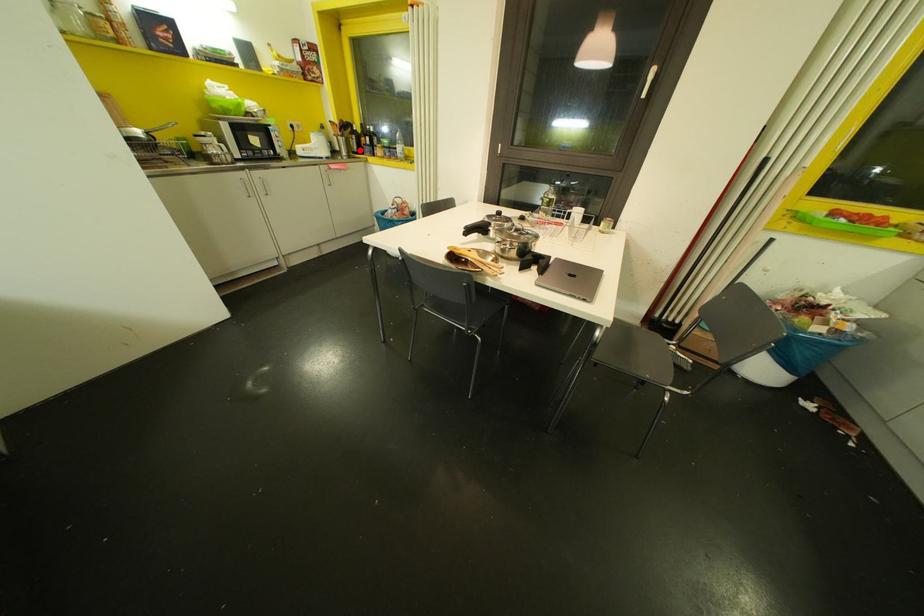
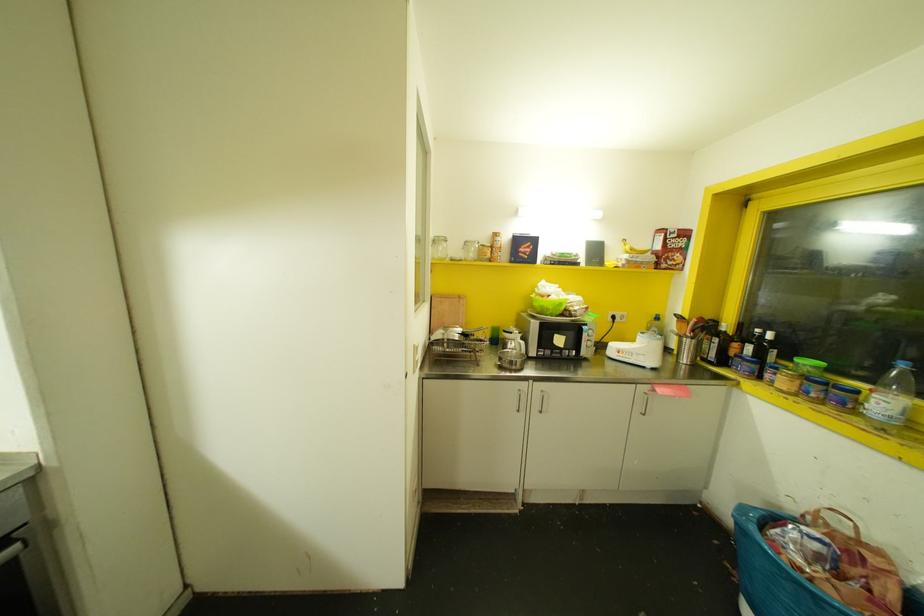
Question: I am providing you with two images of the same scene from different viewpoints. In image1, a red point is highlighted. Considering the same 3D point in image2, which of the following is correct?

Choices:
 (A) It is closer
 (B) It is farther

Answer: (B)